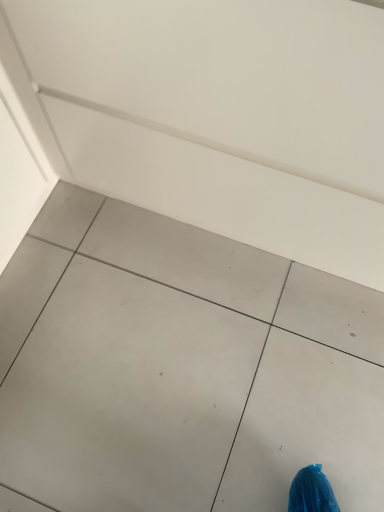
Image resolution: width=384 pixels, height=512 pixels. What do you see at coordinates (180, 368) in the screenshot? I see `gray tile floor at center` at bounding box center [180, 368].

At what (x,y) coordinates should I click in order to perform the action: click on gray tile floor at center. Please return your answer as a coordinate pair (x, y). The image size is (384, 512). Looking at the image, I should click on (180, 368).

I want to click on gray tile floor at center, so click(180, 368).